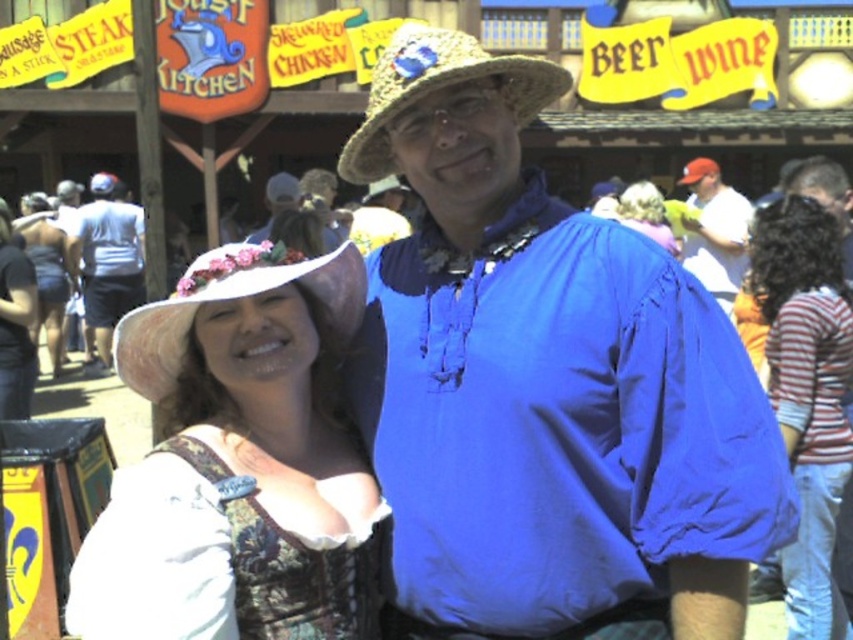
In the Renaissance fair scene, there are two people dressed in period attire. The first person on the left is wearing a white shirt with a dark vest and a flowered hat. The second person on the right is wearing a bright blue tunic with a high collar and a straw hat with a flag. There is also a point marked at coordinates [544,378]. What object or clothing item is located at that point?

The point at [544,378] indicates the location of the blue fabric shirt at center.